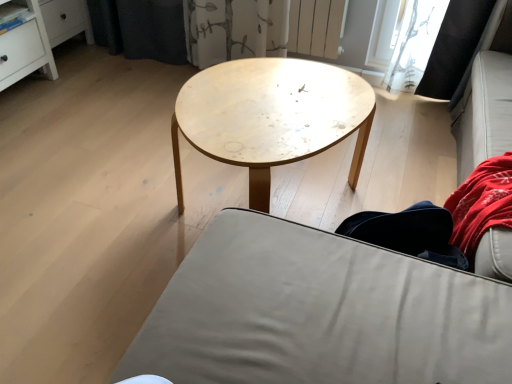
Question: Considering the relative sizes of denim pants at lower right and natural wood coffee table at center in the image provided, is denim pants at lower right wider than natural wood coffee table at center?

Choices:
 (A) no
 (B) yes

Answer: (A)

Question: Considering the relative sizes of denim pants at lower right and natural wood coffee table at center in the image provided, is denim pants at lower right bigger than natural wood coffee table at center?

Choices:
 (A) no
 (B) yes

Answer: (A)

Question: Considering the relative positions of denim pants at lower right and natural wood coffee table at center in the image provided, is denim pants at lower right to the right of natural wood coffee table at center from the viewer's perspective?

Choices:
 (A) yes
 (B) no

Answer: (A)

Question: Is denim pants at lower right oriented away from natural wood coffee table at center?

Choices:
 (A) no
 (B) yes

Answer: (A)

Question: Considering the relative positions of denim pants at lower right and natural wood coffee table at center in the image provided, is denim pants at lower right in front of natural wood coffee table at center?

Choices:
 (A) yes
 (B) no

Answer: (A)

Question: From a real-world perspective, is natural wood coffee table at center above or below matte gray fabric couch at center?

Choices:
 (A) below
 (B) above

Answer: (A)

Question: In the image, is natural wood coffee table at center positioned in front of or behind matte gray fabric couch at center?

Choices:
 (A) behind
 (B) front

Answer: (A)

Question: From the image's perspective, is natural wood coffee table at center above or below matte gray fabric couch at center?

Choices:
 (A) above
 (B) below

Answer: (A)

Question: Is natural wood coffee table at center bigger or smaller than matte gray fabric couch at center?

Choices:
 (A) small
 (B) big

Answer: (A)

Question: In terms of height, does matte gray fabric couch at center look taller or shorter compared to denim pants at lower right?

Choices:
 (A) tall
 (B) short

Answer: (A)

Question: Is matte gray fabric couch at center wider or thinner than denim pants at lower right?

Choices:
 (A) wide
 (B) thin

Answer: (A)

Question: From the image's perspective, is matte gray fabric couch at center located above or below denim pants at lower right?

Choices:
 (A) above
 (B) below

Answer: (B)

Question: In the image, is matte gray fabric couch at center on the left side or the right side of denim pants at lower right?

Choices:
 (A) right
 (B) left

Answer: (B)

Question: From the image's perspective, is denim pants at lower right positioned above or below natural wood coffee table at center?

Choices:
 (A) above
 (B) below

Answer: (B)

Question: Considering the relative positions of denim pants at lower right and natural wood coffee table at center in the image provided, is denim pants at lower right to the left or to the right of natural wood coffee table at center?

Choices:
 (A) right
 (B) left

Answer: (A)